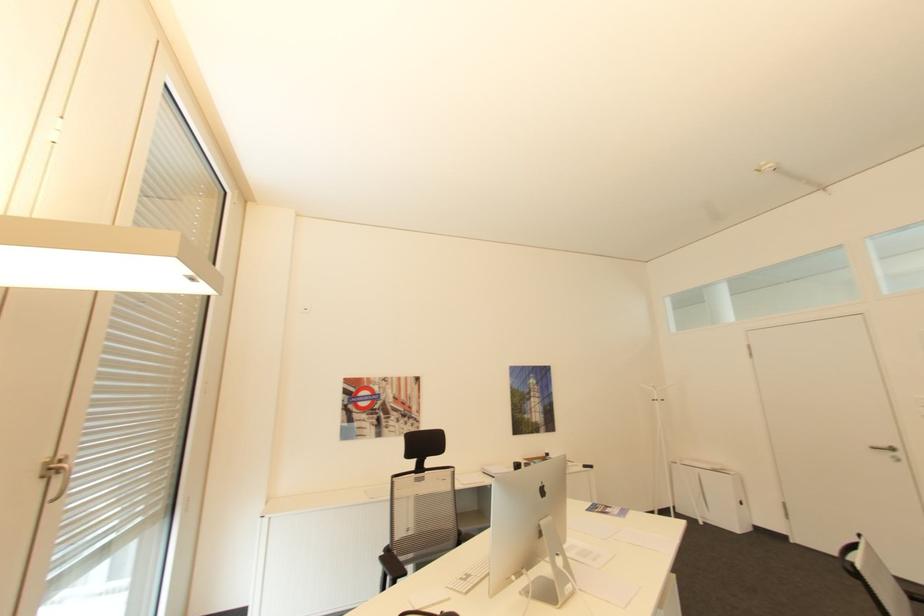
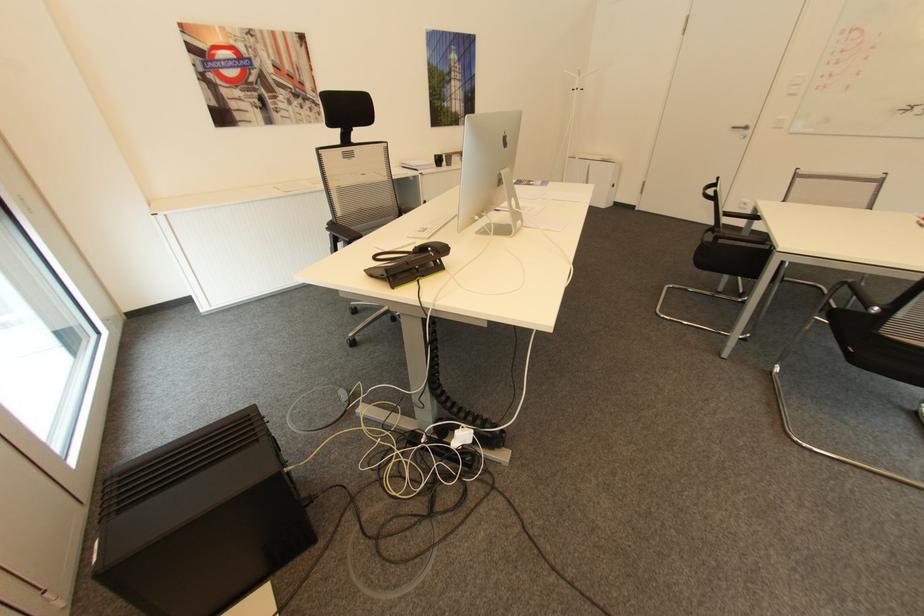
Locate, in the second image, the point that corresponds to the point at 878,448 in the first image.

(736, 128)